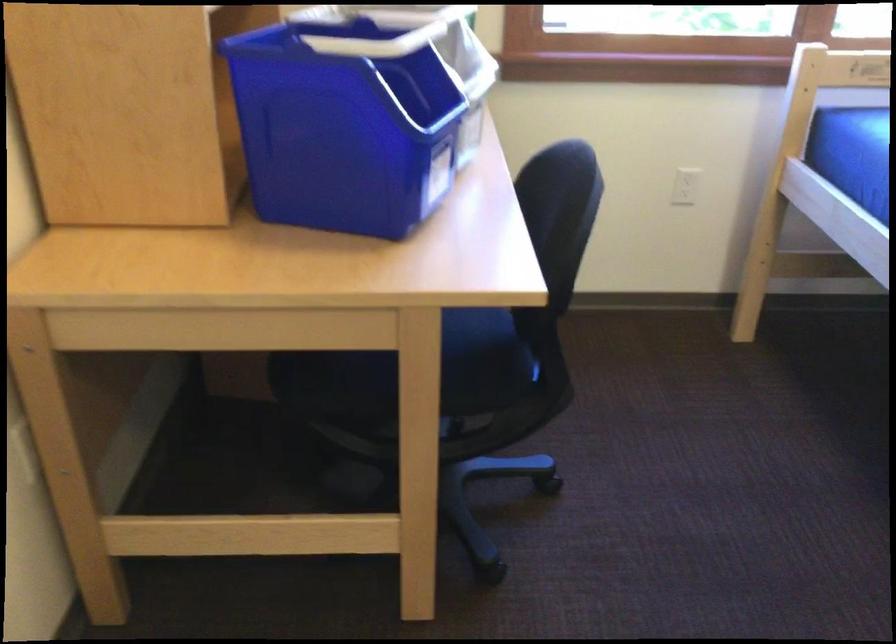
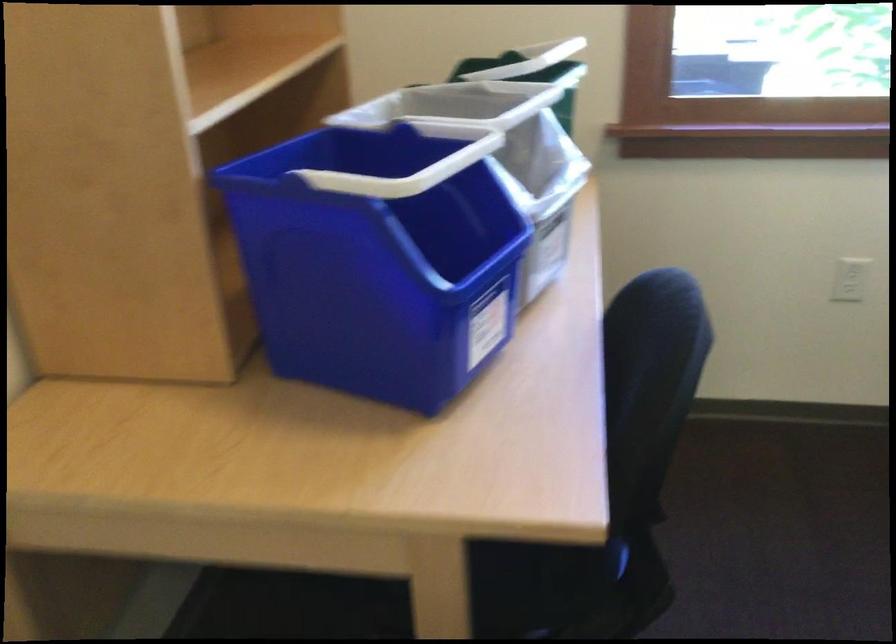
Question: The images are taken continuously from a first-person perspective. In which direction is your viewpoint rotating?

Choices:
 (A) Left
 (B) Right
 (C) Up
 (D) Down

Answer: (A)